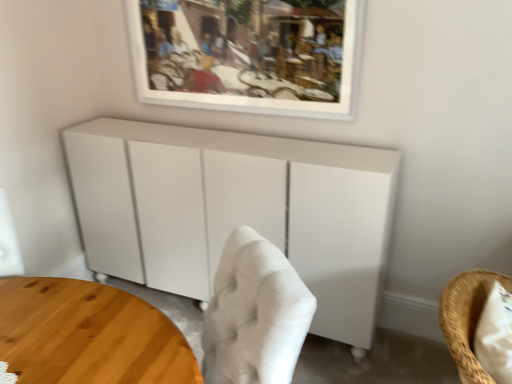
The height and width of the screenshot is (384, 512). In order to click on empty space that is ontop of wooden round table at lower left (from a real-world perspective) in this screenshot , I will do pos(81,326).